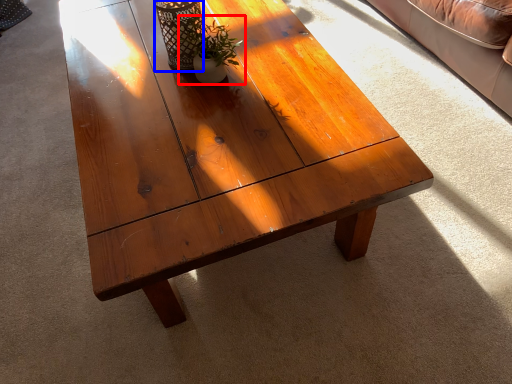
Question: Which point is closer to the camera, houseplant (highlighted by a red box) or glass vase (highlighted by a blue box)?

Choices:
 (A) houseplant
 (B) glass vase

Answer: (A)